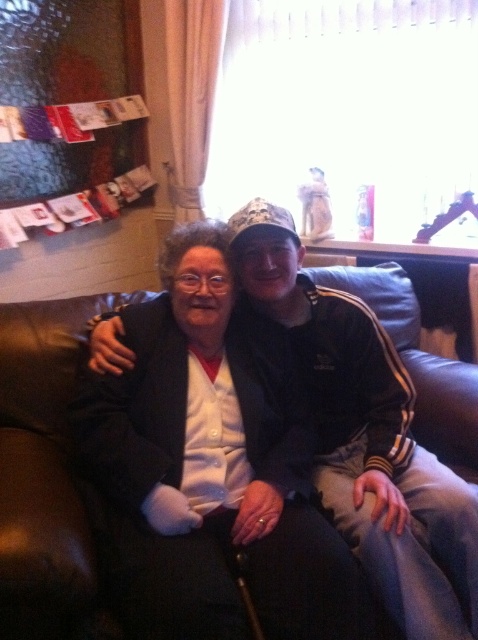
Question: Among these points, which one is nearest to the camera?

Choices:
 (A) (22, 502)
 (B) (369, 392)

Answer: (A)

Question: Does black adidas tracksuit at center appear on the right side of brown leather couch at center?

Choices:
 (A) yes
 (B) no

Answer: (A)

Question: Observing the image, what is the correct spatial positioning of black adidas tracksuit at center in reference to brown leather couch at center?

Choices:
 (A) left
 (B) right

Answer: (B)

Question: Considering the relative positions of black adidas tracksuit at center and brown leather couch at center in the image provided, where is black adidas tracksuit at center located with respect to brown leather couch at center?

Choices:
 (A) right
 (B) left

Answer: (A)